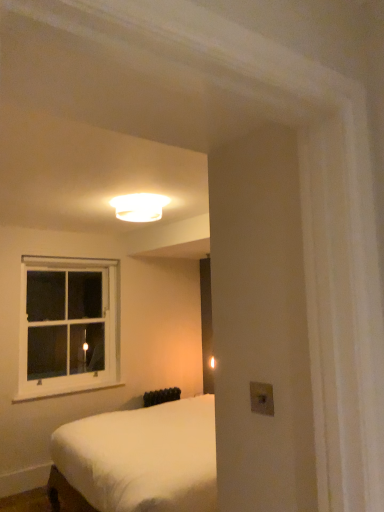
Question: Is point 97,389 closer or farther from the camera than point 147,403?

Choices:
 (A) farther
 (B) closer

Answer: (A)

Question: Is white painted wood at lower left inside or outside of black matte radiator at lower center?

Choices:
 (A) outside
 (B) inside

Answer: (A)

Question: Considering the real-world distances, which object is farthest from the black matte radiator at lower center?

Choices:
 (A) white painted wood at lower left
 (B) white glossy ceiling light at upper center
 (C) white wooden window at upper left

Answer: (B)

Question: Which object is positioned closest to the black matte radiator at lower center?

Choices:
 (A) white glossy ceiling light at upper center
 (B) white painted wood at lower left
 (C) white wooden window at upper left

Answer: (B)